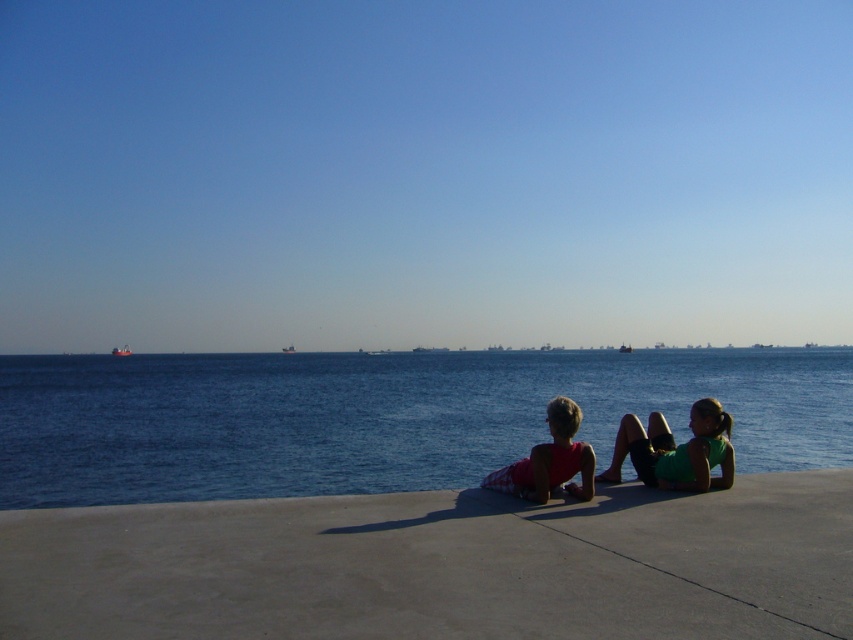
How much distance is there between concretesmooth/solidconcrete at lower center and green fabric shorts at lower right?

concretesmooth/solidconcrete at lower center and green fabric shorts at lower right are 9.02 feet apart.

Does concretesmooth/solidconcrete at lower center have a lesser height compared to green fabric shorts at lower right?

Indeed, concretesmooth/solidconcrete at lower center has a lesser height compared to green fabric shorts at lower right.

I want to click on concretesmooth/solidconcrete at lower center, so click(x=442, y=564).

Is concretesmooth/solidconcrete at lower center taller than matte pink shorts at center?

Incorrect, concretesmooth/solidconcrete at lower center's height is not larger of matte pink shorts at center's.

Based on the photo, can you confirm if concretesmooth/solidconcrete at lower center is wider than matte pink shorts at center?

Correct, the width of concretesmooth/solidconcrete at lower center exceeds that of matte pink shorts at center.

Between point (712, 604) and point (706, 420), which one is positioned behind?

The point (706, 420) is more distant.

I want to click on concretesmooth/solidconcrete at lower center, so click(442, 564).

Looking at this image, can you confirm if blue water at center is positioned to the right of matte pink shorts at center?

Incorrect, blue water at center is not on the right side of matte pink shorts at center.

Does blue water at center have a lesser width compared to matte pink shorts at center?

No, blue water at center is not thinner than matte pink shorts at center.

Does point (445, 378) come farther from viewer compared to point (706, 440)?

That is True.

The image size is (853, 640). Find the location of `blue water at center`. blue water at center is located at coordinates (379, 417).